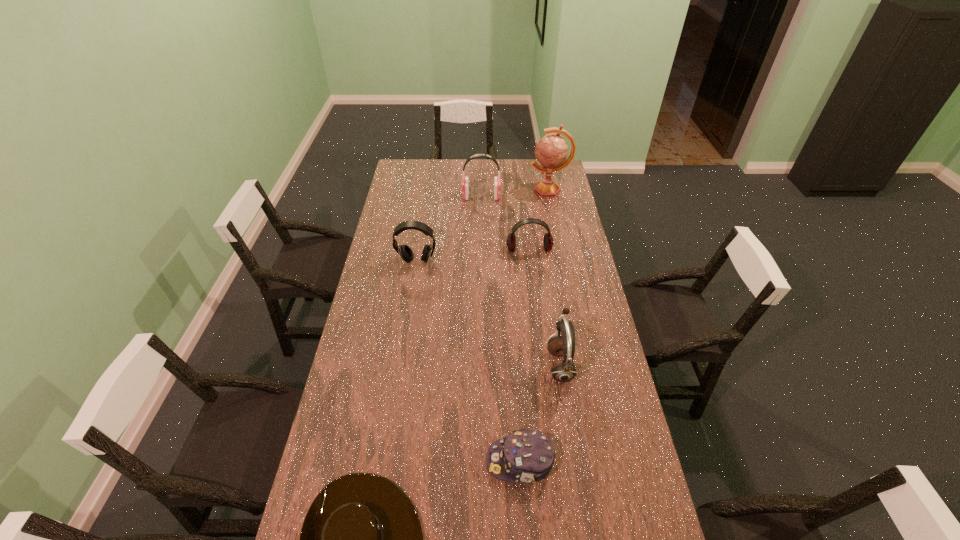
Image resolution: width=960 pixels, height=540 pixels. I want to click on object located in the far edge section of the desktop, so click(551, 151).

The width and height of the screenshot is (960, 540). What are the coordinates of `object at the left edge` in the screenshot? It's located at (405, 252).

Find the location of a particular element. This screenshot has width=960, height=540. globe located in the right edge section of the desktop is located at coordinates (551, 151).

Locate an element on the screen. Image resolution: width=960 pixels, height=540 pixels. object at the far right corner is located at coordinates (551, 151).

Where is `vacant area at the left edge`? The width and height of the screenshot is (960, 540). vacant area at the left edge is located at coordinates (404, 271).

Locate an element on the screen. free region at the right edge of the desktop is located at coordinates (635, 443).

Where is `blank space at the far left corner`? blank space at the far left corner is located at coordinates (411, 174).

You are a GUI agent. You are given a task and a screenshot of the screen. Output one action in this format:
    pyautogui.click(x=<x>, y=<y>)
    Task: Click on the vacant region between the farthest earphone and the leftmost earphone
    The width and height of the screenshot is (960, 540).
    Given the screenshot: What is the action you would take?
    pyautogui.click(x=449, y=229)

The image size is (960, 540). In order to click on empty location between the headwear and the second earphone from left to right in this screenshot , I will do `click(501, 329)`.

The height and width of the screenshot is (540, 960). I want to click on free space between the leftmost earphone and the headwear, so click(468, 361).